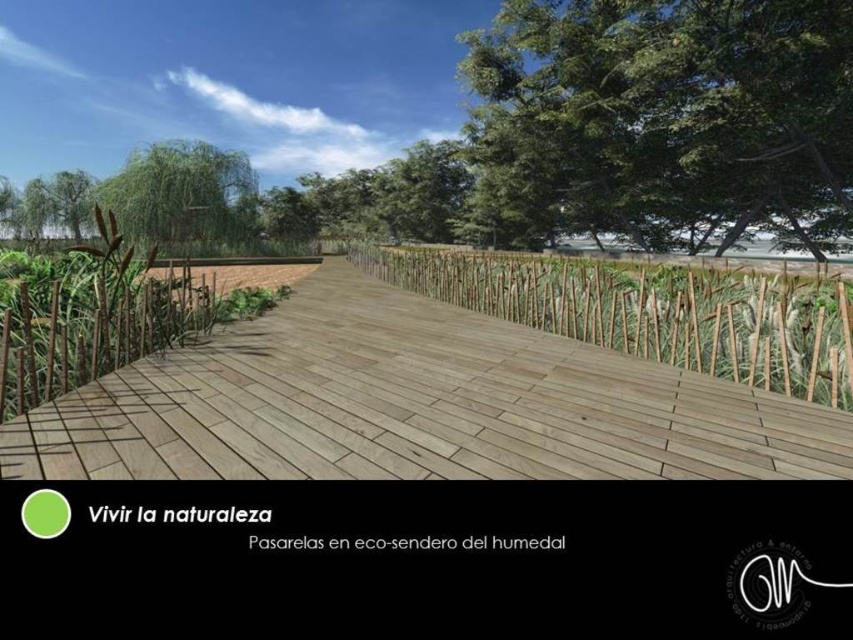
This screenshot has height=640, width=853. What do you see at coordinates (668, 116) in the screenshot?
I see `green leafy tree at upper right` at bounding box center [668, 116].

Does green leafy tree at upper right have a lesser height compared to green leafy tree at upper left?

Yes, green leafy tree at upper right is shorter than green leafy tree at upper left.

The width and height of the screenshot is (853, 640). What do you see at coordinates (668, 116) in the screenshot?
I see `green leafy tree at upper right` at bounding box center [668, 116].

Where is `green leafy tree at upper right`? Image resolution: width=853 pixels, height=640 pixels. green leafy tree at upper right is located at coordinates (668, 116).

Does green leafy tree at upper right have a greater width compared to brown textured reed at left?

Indeed, green leafy tree at upper right has a greater width compared to brown textured reed at left.

Does point (721, 202) come farther from viewer compared to point (109, 272)?

Yes, it is.

Find the location of a particular element. The image size is (853, 640). green leafy tree at upper right is located at coordinates (668, 116).

Can you confirm if wooden at center is positioned to the left of green leafy tree at upper right?

Correct, you'll find wooden at center to the left of green leafy tree at upper right.

Who is lower down, wooden at center or green leafy tree at upper right?

wooden at center is below.

Find the location of a particular element. The width and height of the screenshot is (853, 640). wooden at center is located at coordinates point(415,404).